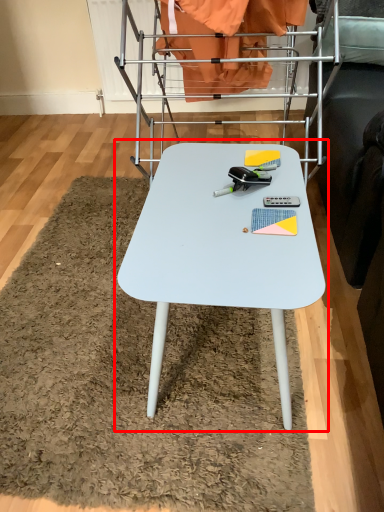
Question: From the image's perspective, considering the relative positions of table (annotated by the red box) and bunk bed in the image provided, where is table (annotated by the red box) located with respect to the staircase?

Choices:
 (A) below
 (B) above

Answer: (A)